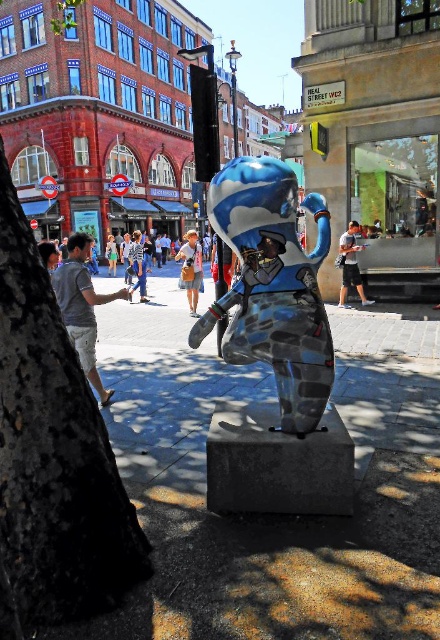
Question: In this image, where is dark brown bark at left located relative to shiny metallic figure at center?

Choices:
 (A) below
 (B) above

Answer: (A)

Question: Does dark brown bark at left appear on the left side of blue denim jeans at center?

Choices:
 (A) no
 (B) yes

Answer: (A)

Question: Which object appears closest to the camera in this image?

Choices:
 (A) dark brown bark at left
 (B) gray cotton t-shirt at left

Answer: (A)

Question: Observing the image, what is the correct spatial positioning of dark brown bark at left in reference to denim skirt at center?

Choices:
 (A) left
 (B) right

Answer: (B)

Question: Which object is the closest to the blue denim jeans at center?

Choices:
 (A) matte blue and white sculpture at center
 (B) shiny metallic figure at center
 (C) gray cotton t-shirt at left

Answer: (A)

Question: Which is farther from the gray cotton t-shirt at left?

Choices:
 (A) blue denim jeans at center
 (B) matte blue and white sculpture at center
 (C) dark brown bark at left

Answer: (A)